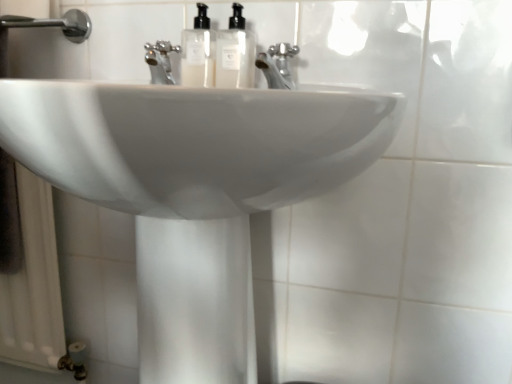
Question: Can you confirm if chrome metallic faucet at center is bigger than translucent plastic soap dispenser at center, the second soap dispenser viewed from the left?

Choices:
 (A) yes
 (B) no

Answer: (A)

Question: Is chrome metallic faucet at center to the left of translucent plastic soap dispenser at center, the second soap dispenser viewed from the left, from the viewer's perspective?

Choices:
 (A) yes
 (B) no

Answer: (B)

Question: Can you confirm if chrome metallic faucet at center is thinner than translucent plastic soap dispenser at center, placed as the 1th soap dispenser when sorted from right to left?

Choices:
 (A) no
 (B) yes

Answer: (A)

Question: Is chrome metallic faucet at center not close to translucent plastic soap dispenser at center, placed as the 1th soap dispenser when sorted from right to left?

Choices:
 (A) no
 (B) yes

Answer: (A)

Question: Considering the relative sizes of chrome metallic faucet at center and translucent plastic soap dispenser at center, the second soap dispenser viewed from the left, in the image provided, is chrome metallic faucet at center smaller than translucent plastic soap dispenser at center, the second soap dispenser viewed from the left,?

Choices:
 (A) yes
 (B) no

Answer: (B)

Question: Which is correct: translucent plastic soap dispenser at center, placed as the 1th soap dispenser when sorted from right to left, is inside translucent plastic soap dispenser at center, which is the first soap dispenser in left-to-right order, or outside of it?

Choices:
 (A) inside
 (B) outside

Answer: (B)

Question: From a real-world perspective, is translucent plastic soap dispenser at center, the second soap dispenser viewed from the left, physically located above or below translucent plastic soap dispenser at center, which is the first soap dispenser in left-to-right order?

Choices:
 (A) below
 (B) above

Answer: (A)

Question: Considering the positions of translucent plastic soap dispenser at center, the second soap dispenser viewed from the left, and translucent plastic soap dispenser at center, which is the first soap dispenser in left-to-right order, in the image, is translucent plastic soap dispenser at center, the second soap dispenser viewed from the left, taller or shorter than translucent plastic soap dispenser at center, which is the first soap dispenser in left-to-right order,?

Choices:
 (A) tall
 (B) short

Answer: (A)

Question: From the image's perspective, is translucent plastic soap dispenser at center, the second soap dispenser viewed from the left, located above or below translucent plastic soap dispenser at center, which is the 2th soap dispenser from right to left?

Choices:
 (A) above
 (B) below

Answer: (B)

Question: In terms of height, does chrome metallic faucet at center look taller or shorter compared to white glossy sink at center?

Choices:
 (A) short
 (B) tall

Answer: (A)

Question: Based on their sizes in the image, would you say chrome metallic faucet at center is bigger or smaller than white glossy sink at center?

Choices:
 (A) small
 (B) big

Answer: (A)

Question: Relative to white glossy sink at center, is chrome metallic faucet at center in front or behind?

Choices:
 (A) behind
 (B) front

Answer: (A)

Question: From a real-world perspective, is chrome metallic faucet at center above or below white glossy sink at center?

Choices:
 (A) below
 (B) above

Answer: (B)

Question: In terms of width, does white glossy sink at center look wider or thinner when compared to translucent plastic soap dispenser at center, placed as the 1th soap dispenser when sorted from right to left?

Choices:
 (A) wide
 (B) thin

Answer: (A)

Question: Considering the positions of white glossy sink at center and translucent plastic soap dispenser at center, placed as the 1th soap dispenser when sorted from right to left, in the image, is white glossy sink at center taller or shorter than translucent plastic soap dispenser at center, placed as the 1th soap dispenser when sorted from right to left,?

Choices:
 (A) tall
 (B) short

Answer: (A)